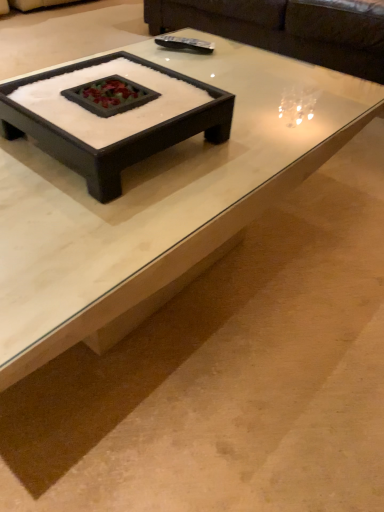
Measure the distance between black matte tray at center, placed as the 1th coffee table when sorted from back to front, and camera.

A distance of 27.74 inches exists between black matte tray at center, placed as the 1th coffee table when sorted from back to front, and camera.

Locate an element on the screen. black matte tray at center, the second coffee table in the front-to-back sequence is located at coordinates (120, 140).

Can you confirm if black matte tray at center, the second coffee table in the front-to-back sequence, is smaller than white glossy coffee table at center, which appears as the first coffee table when viewed from the front?

Yes, black matte tray at center, the second coffee table in the front-to-back sequence, is smaller than white glossy coffee table at center, which appears as the first coffee table when viewed from the front.

At what (x,y) coordinates should I click in order to perform the action: click on coffee table in front of the black matte tray at center, placed as the 1th coffee table when sorted from back to front. Please return your answer as a coordinate pair (x, y). The image size is (384, 512). Looking at the image, I should click on (158, 199).

Is white glossy coffee table at center, the 2th coffee table viewed from the back, at the back of black matte tray at center, placed as the 1th coffee table when sorted from back to front?

That's not correct — black matte tray at center, placed as the 1th coffee table when sorted from back to front, is not looking away from white glossy coffee table at center, the 2th coffee table viewed from the back.

Is black matte tray at center, placed as the 1th coffee table when sorted from back to front, inside the boundaries of white glossy coffee table at center, the 2th coffee table viewed from the back, or outside?

black matte tray at center, placed as the 1th coffee table when sorted from back to front, is not inside white glossy coffee table at center, the 2th coffee table viewed from the back, it's outside.

In terms of height, does white glossy coffee table at center, which appears as the first coffee table when viewed from the front, look taller or shorter compared to black matte tray at center, placed as the 1th coffee table when sorted from back to front?

In the image, white glossy coffee table at center, which appears as the first coffee table when viewed from the front, appears to be taller than black matte tray at center, placed as the 1th coffee table when sorted from back to front.

Which of these two, white glossy coffee table at center, the 2th coffee table viewed from the back, or black matte tray at center, placed as the 1th coffee table when sorted from back to front, is smaller?

black matte tray at center, placed as the 1th coffee table when sorted from back to front.

Is white glossy coffee table at center, which appears as the first coffee table when viewed from the front, aimed at black matte tray at center, placed as the 1th coffee table when sorted from back to front?

No, white glossy coffee table at center, which appears as the first coffee table when viewed from the front, is not turned towards black matte tray at center, placed as the 1th coffee table when sorted from back to front.

From a real-world perspective, who is located higher, white glossy coffee table at center, the 2th coffee table viewed from the back, or black matte tray at center, the second coffee table in the front-to-back sequence?

black matte tray at center, the second coffee table in the front-to-back sequence, is physically above.

Does white glossy coffee table at center, which appears as the first coffee table when viewed from the front, appear on the right side of dark brown leather couch at upper center?

No, white glossy coffee table at center, which appears as the first coffee table when viewed from the front, is not to the right of dark brown leather couch at upper center.

How many degrees apart are the facing directions of white glossy coffee table at center, which appears as the first coffee table when viewed from the front, and dark brown leather couch at upper center?

89.5 degrees.

From the image's perspective, between white glossy coffee table at center, the 2th coffee table viewed from the back, and dark brown leather couch at upper center, which one is located above?

From the image's view, dark brown leather couch at upper center is above.

From a real-world perspective, is white glossy coffee table at center, the 2th coffee table viewed from the back, physically located above or below dark brown leather couch at upper center?

white glossy coffee table at center, the 2th coffee table viewed from the back, is below dark brown leather couch at upper center.

Where is `couch above the black matte tray at center, placed as the 1th coffee table when sorted from back to front (from the image's perspective)`? couch above the black matte tray at center, placed as the 1th coffee table when sorted from back to front (from the image's perspective) is located at coordinates (286, 29).

From a real-world perspective, is black matte tray at center, placed as the 1th coffee table when sorted from back to front, beneath dark brown leather couch at upper center?

Actually, black matte tray at center, placed as the 1th coffee table when sorted from back to front, is physically above dark brown leather couch at upper center in the real world.

Is black matte tray at center, placed as the 1th coffee table when sorted from back to front, not within dark brown leather couch at upper center?

black matte tray at center, placed as the 1th coffee table when sorted from back to front, lies outside dark brown leather couch at upper center's area.

From the image's perspective, does black matte tray at center, the second coffee table in the front-to-back sequence, appear higher than dark brown leather couch at upper center?

No, from the image's perspective, black matte tray at center, the second coffee table in the front-to-back sequence, is not on top of dark brown leather couch at upper center.

Considering the positions of points (214, 24) and (176, 260), is point (214, 24) closer to camera compared to point (176, 260)?

No, it is behind (176, 260).

From the image's perspective, is dark brown leather couch at upper center below white glossy coffee table at center, which appears as the first coffee table when viewed from the front?

Incorrect, from the image's perspective, dark brown leather couch at upper center is higher than white glossy coffee table at center, which appears as the first coffee table when viewed from the front.

Is dark brown leather couch at upper center aimed at white glossy coffee table at center, the 2th coffee table viewed from the back?

Yes, dark brown leather couch at upper center faces towards white glossy coffee table at center, the 2th coffee table viewed from the back.

Would you say dark brown leather couch at upper center is inside or outside black matte tray at center, the second coffee table in the front-to-back sequence?

dark brown leather couch at upper center is not inside black matte tray at center, the second coffee table in the front-to-back sequence, it's outside.

Considering the relative sizes of dark brown leather couch at upper center and black matte tray at center, placed as the 1th coffee table when sorted from back to front, in the image provided, is dark brown leather couch at upper center smaller than black matte tray at center, placed as the 1th coffee table when sorted from back to front,?

No.

Between dark brown leather couch at upper center and black matte tray at center, placed as the 1th coffee table when sorted from back to front, which one appears on the right side from the viewer's perspective?

dark brown leather couch at upper center is more to the right.

Considering the sizes of objects dark brown leather couch at upper center and black matte tray at center, the second coffee table in the front-to-back sequence, in the image provided, who is thinner, dark brown leather couch at upper center or black matte tray at center, the second coffee table in the front-to-back sequence,?

Thinner between the two is black matte tray at center, the second coffee table in the front-to-back sequence.

You are a GUI agent. You are given a task and a screenshot of the screen. Output one action in this format:
    pyautogui.click(x=<x>, y=<y>)
    Task: Click on the coffee table below the black matte tray at center, the second coffee table in the front-to-back sequence (from a real-world perspective)
    The width and height of the screenshot is (384, 512).
    Given the screenshot: What is the action you would take?
    pyautogui.click(x=158, y=199)

In order to click on coffee table behind the white glossy coffee table at center, which appears as the first coffee table when viewed from the front in this screenshot , I will do `click(120, 140)`.

When comparing their distances from dark brown leather couch at upper center, does black matte tray at center, the second coffee table in the front-to-back sequence, or white glossy coffee table at center, which appears as the first coffee table when viewed from the front, seem further?

black matte tray at center, the second coffee table in the front-to-back sequence, is further to dark brown leather couch at upper center.

When comparing their distances from black matte tray at center, placed as the 1th coffee table when sorted from back to front, does dark brown leather couch at upper center or white glossy coffee table at center, which appears as the first coffee table when viewed from the front, seem closer?

white glossy coffee table at center, which appears as the first coffee table when viewed from the front, is closer to black matte tray at center, placed as the 1th coffee table when sorted from back to front.

Based on their spatial positions, is dark brown leather couch at upper center or black matte tray at center, placed as the 1th coffee table when sorted from back to front, further from white glossy coffee table at center, which appears as the first coffee table when viewed from the front?

Based on the image, dark brown leather couch at upper center appears to be further to white glossy coffee table at center, which appears as the first coffee table when viewed from the front.

Which object lies further to the anchor point black matte tray at center, placed as the 1th coffee table when sorted from back to front, white glossy coffee table at center, which appears as the first coffee table when viewed from the front, or dark brown leather couch at upper center?

dark brown leather couch at upper center lies further to black matte tray at center, placed as the 1th coffee table when sorted from back to front, than the other object.

When comparing their distances from dark brown leather couch at upper center, does white glossy coffee table at center, the 2th coffee table viewed from the back, or black matte tray at center, placed as the 1th coffee table when sorted from back to front, seem closer?

Among the two, white glossy coffee table at center, the 2th coffee table viewed from the back, is located nearer to dark brown leather couch at upper center.

Considering their positions, is black matte tray at center, the second coffee table in the front-to-back sequence, positioned further to white glossy coffee table at center, which appears as the first coffee table when viewed from the front, than dark brown leather couch at upper center?

The object further to white glossy coffee table at center, which appears as the first coffee table when viewed from the front, is dark brown leather couch at upper center.

This screenshot has width=384, height=512. I want to click on coffee table between dark brown leather couch at upper center and white glossy coffee table at center, which appears as the first coffee table when viewed from the front, vertically, so click(x=120, y=140).